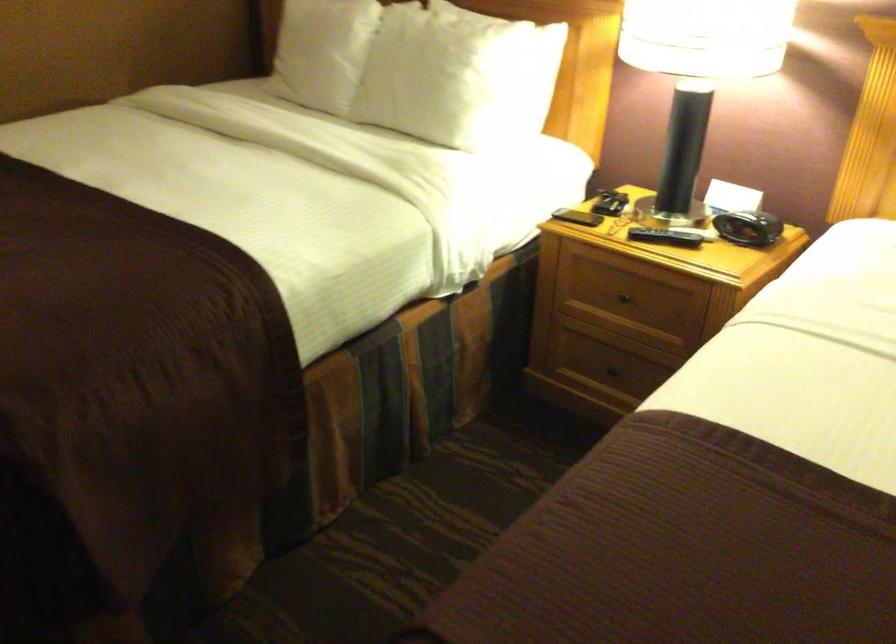
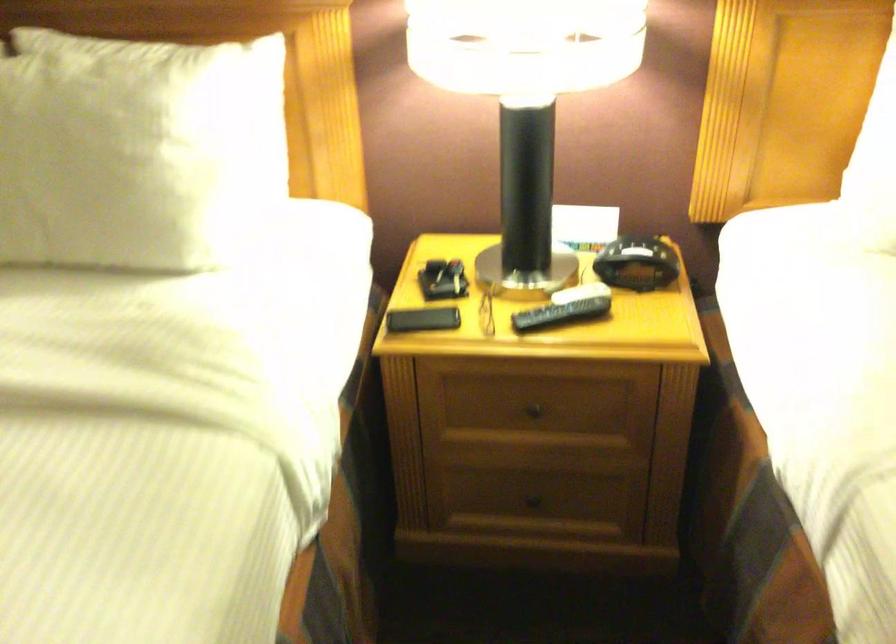
In the second image, find the point that corresponds to the point at 741,225 in the first image.

(636, 263)